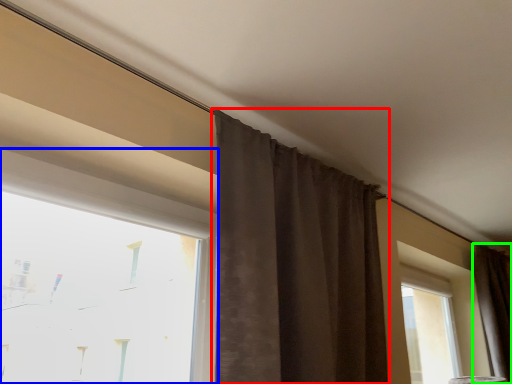
Question: Which object is positioned farthest from curtain (highlighted by a red box)? Select from window (highlighted by a blue box) and curtain (highlighted by a green box).

Choices:
 (A) window
 (B) curtain

Answer: (B)